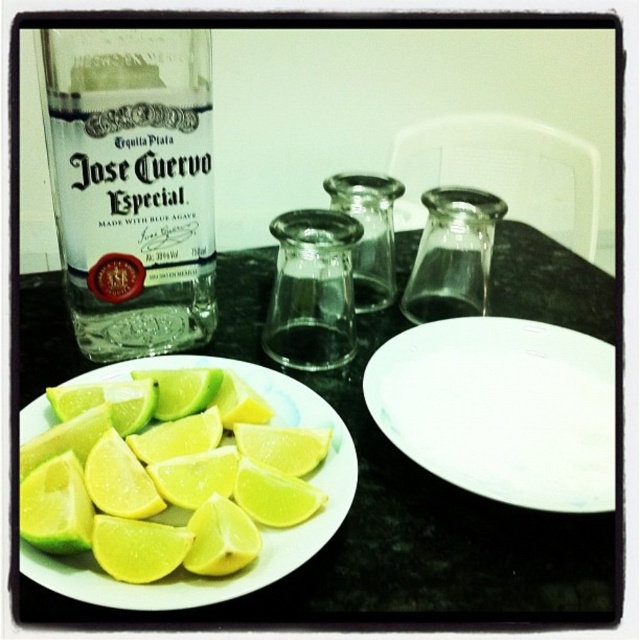
Question: Which point appears farthest from the camera in this image?

Choices:
 (A) (564, 380)
 (B) (348, 458)
 (C) (268, 513)
 (D) (392, 269)

Answer: (D)

Question: Estimate the real-world distances between objects in this image. Which object is closer to the transparent glass bottle at left?

Choices:
 (A) transparent glass shot glasses at center
 (B) green matte plate at lower left
 (C) yellow matte lemon at lower left

Answer: (B)

Question: Is green matte lime slices at lower left bigger than transparent glass salt shaker at center-right?

Choices:
 (A) yes
 (B) no

Answer: (A)

Question: Which object is positioned closest to the green matte lime slices at lower left?

Choices:
 (A) transparent glass salt shaker at center-right
 (B) transparent glass bottle at left
 (C) yellow matte lemon at lower left
 (D) green matte plate at lower left

Answer: (C)

Question: Is green matte plate at lower left closer to the viewer compared to transparent glass bottle at left?

Choices:
 (A) yes
 (B) no

Answer: (A)

Question: Does white matte plate at center appear on the right side of yellow matte lemon at lower left?

Choices:
 (A) no
 (B) yes

Answer: (B)